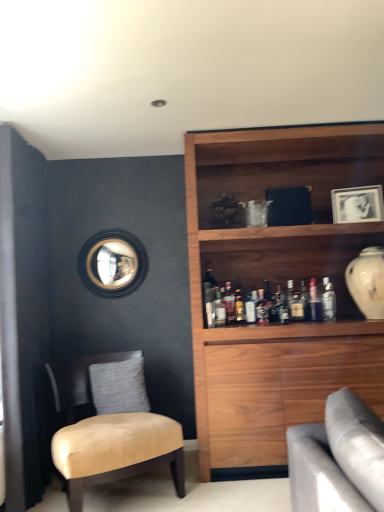
Question: Is there a large distance between matte glass bottle at upper right, the fifth bottle positioned from the left, and satin silver bottle at upper right, positioned as the sixth bottle in left-to-right order?

Choices:
 (A) no
 (B) yes

Answer: (A)

Question: Is matte glass bottle at upper right, the fifth bottle positioned from the left, facing away from satin silver bottle at upper right, the 2th bottle viewed from the right?

Choices:
 (A) yes
 (B) no

Answer: (B)

Question: Is matte glass bottle at upper right, which is the 3th bottle from right to left, not within satin silver bottle at upper right, the 2th bottle viewed from the right?

Choices:
 (A) yes
 (B) no

Answer: (A)

Question: Is matte glass bottle at upper right, the fifth bottle positioned from the left, facing towards satin silver bottle at upper right, the 2th bottle viewed from the right?

Choices:
 (A) yes
 (B) no

Answer: (A)

Question: From the image's perspective, is matte glass bottle at upper right, the fifth bottle positioned from the left, located above satin silver bottle at upper right, positioned as the sixth bottle in left-to-right order?

Choices:
 (A) no
 (B) yes

Answer: (A)

Question: In terms of height, does black matte picture frame at upper right look taller or shorter compared to clear glass bottle at upper right, arranged as the seventh bottle when viewed from the left?

Choices:
 (A) tall
 (B) short

Answer: (A)

Question: Considering the relative positions of black matte picture frame at upper right and clear glass bottle at upper right, arranged as the seventh bottle when viewed from the left, in the image provided, is black matte picture frame at upper right to the left or to the right of clear glass bottle at upper right, arranged as the seventh bottle when viewed from the left,?

Choices:
 (A) left
 (B) right

Answer: (B)

Question: Do you think black matte picture frame at upper right is within clear glass bottle at upper right, arranged as the seventh bottle when viewed from the left, or outside of it?

Choices:
 (A) outside
 (B) inside

Answer: (A)

Question: From a real-world perspective, relative to clear glass bottle at upper right, which is the first bottle from right to left, is black matte picture frame at upper right vertically above or below?

Choices:
 (A) above
 (B) below

Answer: (A)

Question: Considering the positions of point (281, 303) and point (142, 271), is point (281, 303) closer or farther from the camera than point (142, 271)?

Choices:
 (A) closer
 (B) farther

Answer: (A)

Question: From the image's perspective, is matte glass bottle at center, the fourth bottle from the left, above or below matte black mirror at upper left?

Choices:
 (A) below
 (B) above

Answer: (A)

Question: Is matte glass bottle at center, the fourth bottle from the left, taller or shorter than matte black mirror at upper left?

Choices:
 (A) short
 (B) tall

Answer: (A)

Question: Is matte glass bottle at center, which is counted as the fourth bottle, starting from the right, inside or outside of matte black mirror at upper left?

Choices:
 (A) outside
 (B) inside

Answer: (A)

Question: In terms of height, does matte glass bottle at upper right, which is the 3th bottle from right to left, look taller or shorter compared to white glossy vase at upper right?

Choices:
 (A) short
 (B) tall

Answer: (A)

Question: In terms of width, does matte glass bottle at upper right, which is the 3th bottle from right to left, look wider or thinner when compared to white glossy vase at upper right?

Choices:
 (A) thin
 (B) wide

Answer: (A)